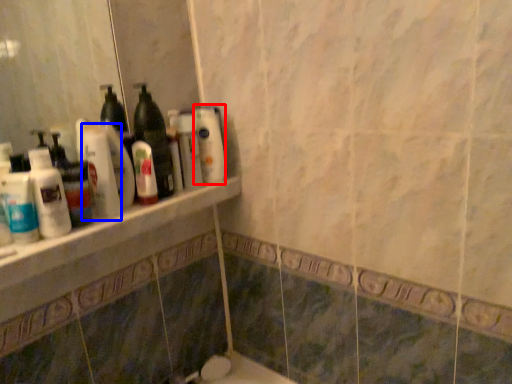
Question: Which point is further to the camera, cleaning product (highlighted by a red box) or cleaning product (highlighted by a blue box)?

Choices:
 (A) cleaning product
 (B) cleaning product

Answer: (A)